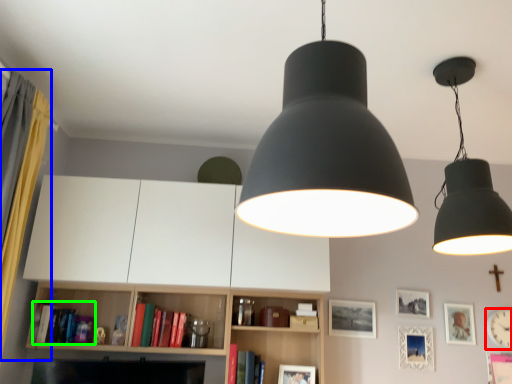
Question: Which object is positioned closest to clock (highlighted by a red box)? Select from curtain (highlighted by a blue box) and book (highlighted by a green box).

Choices:
 (A) curtain
 (B) book

Answer: (B)